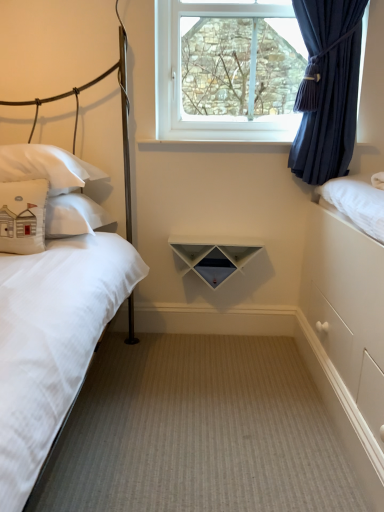
Question: Is white matte triangle at center shorter than beige carpet at center?

Choices:
 (A) yes
 (B) no

Answer: (B)

Question: Is white matte triangle at center bigger than beige carpet at center?

Choices:
 (A) no
 (B) yes

Answer: (A)

Question: From the image's perspective, is white matte triangle at center over beige carpet at center?

Choices:
 (A) yes
 (B) no

Answer: (A)

Question: From a real-world perspective, is white matte triangle at center positioned over beige carpet at center based on gravity?

Choices:
 (A) no
 (B) yes

Answer: (B)

Question: Is white matte triangle at center positioned with its back to beige carpet at center?

Choices:
 (A) yes
 (B) no

Answer: (B)

Question: Does white matte triangle at center turn towards beige carpet at center?

Choices:
 (A) yes
 (B) no

Answer: (B)

Question: Considering the relative sizes of white matte bed at left and clear glass window at upper center in the image provided, is white matte bed at left smaller than clear glass window at upper center?

Choices:
 (A) yes
 (B) no

Answer: (B)

Question: Can you confirm if white matte bed at left is taller than clear glass window at upper center?

Choices:
 (A) no
 (B) yes

Answer: (B)

Question: From a real-world perspective, is white matte bed at left beneath clear glass window at upper center?

Choices:
 (A) yes
 (B) no

Answer: (A)

Question: Does white matte bed at left have a larger size compared to clear glass window at upper center?

Choices:
 (A) yes
 (B) no

Answer: (A)

Question: Can clear glass window at upper center be found inside white matte bed at left?

Choices:
 (A) no
 (B) yes

Answer: (A)

Question: Is the position of white matte bed at left more distant than that of clear glass window at upper center?

Choices:
 (A) yes
 (B) no

Answer: (B)

Question: Does beige fabric pillow at left, the second pillow positioned from the back, have a larger size compared to white matte triangle at center?

Choices:
 (A) yes
 (B) no

Answer: (B)